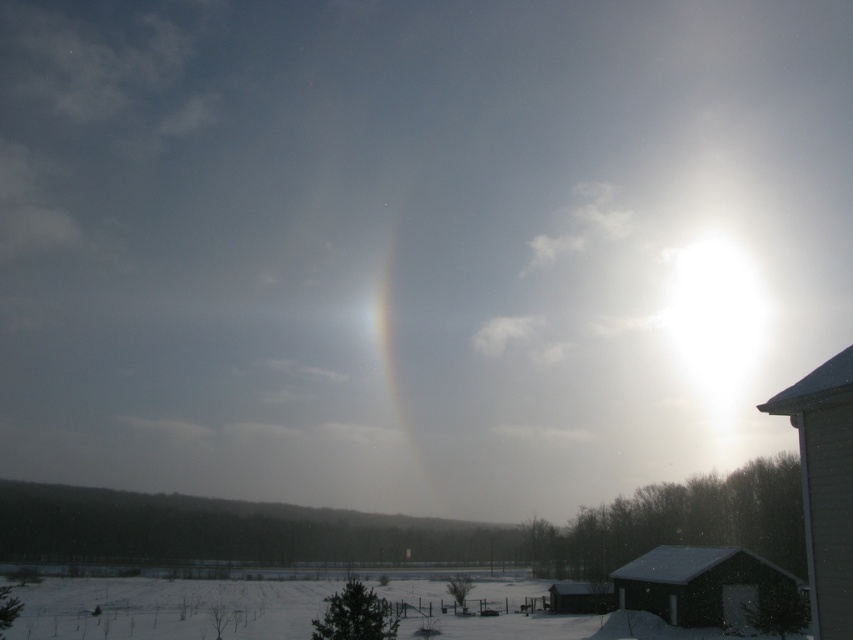
Can you confirm if gray wood cabin at right is positioned to the left of dark gray wooden hut at lower right?

Indeed, gray wood cabin at right is positioned on the left side of dark gray wooden hut at lower right.

What do you see at coordinates (824, 486) in the screenshot? I see `gray wood cabin at right` at bounding box center [824, 486].

You are a GUI agent. You are given a task and a screenshot of the screen. Output one action in this format:
    pyautogui.click(x=<x>, y=<y>)
    Task: Click on the gray wood cabin at right
    
    Given the screenshot: What is the action you would take?
    pyautogui.click(x=824, y=486)

Is gray wood cabin at right above wooden cabin at lower center?

Yes, gray wood cabin at right is above wooden cabin at lower center.

Is the position of gray wood cabin at right more distant than that of wooden cabin at lower center?

No, gray wood cabin at right is closer to the viewer.

Find the location of `gray wood cabin at right`. gray wood cabin at right is located at coordinates (824, 486).

Who is more distant from viewer, (410, 438) or (596, 604)?

The point (410, 438) is behind.

Between white translucent ring at center and wooden cabin at lower center, which one appears on the right side from the viewer's perspective?

wooden cabin at lower center

Is point (389, 360) behind point (556, 605)?

Yes, it is behind point (556, 605).

I want to click on white translucent ring at center, so click(397, 380).